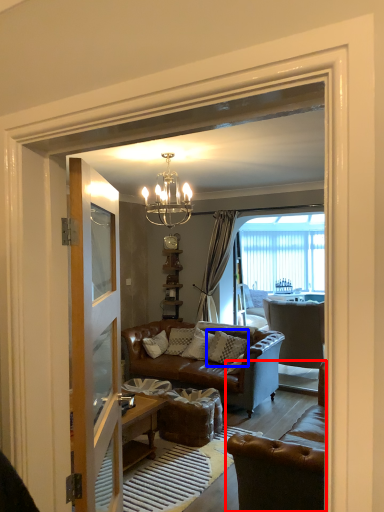
Question: Which point is further to the camera, chair (highlighted by a red box) or pillow (highlighted by a blue box)?

Choices:
 (A) chair
 (B) pillow

Answer: (B)